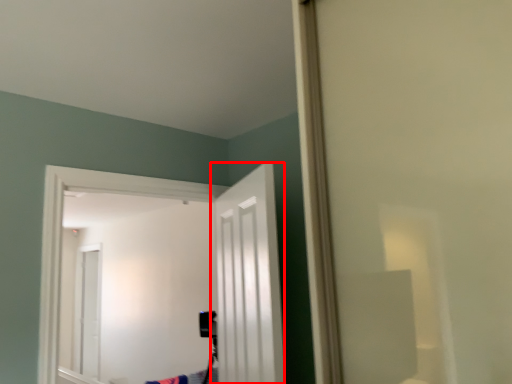
Question: From the image's perspective, where is door (annotated by the red box) located relative to door?

Choices:
 (A) above
 (B) below

Answer: (A)